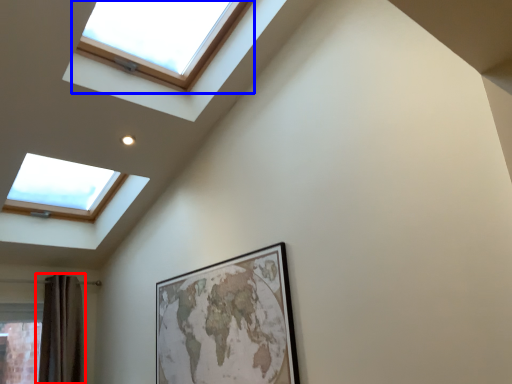
Question: Among these objects, which one is nearest to the camera, shower curtain (highlighted by a red box) or window (highlighted by a blue box)?

Choices:
 (A) shower curtain
 (B) window

Answer: (B)